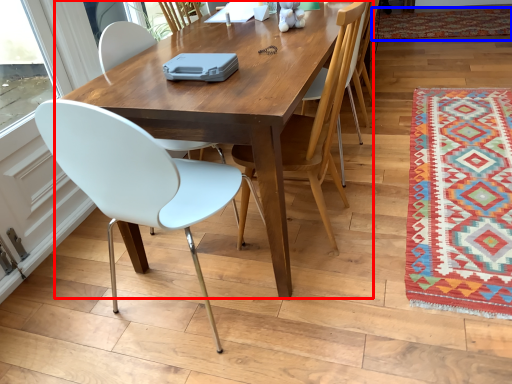
Question: Which of the following is the farthest to the observer, kitchen & dining room table (highlighted by a red box) or mat (highlighted by a blue box)?

Choices:
 (A) kitchen & dining room table
 (B) mat

Answer: (B)